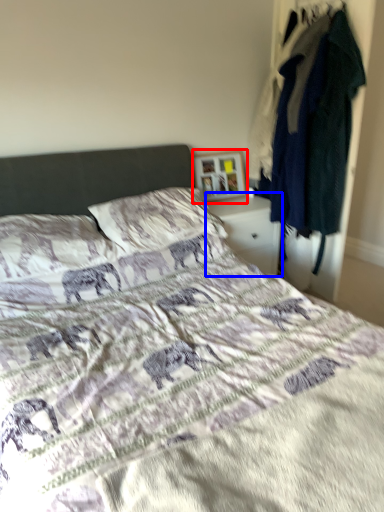
Question: Among these objects, which one is nearest to the camera, picture frame (highlighted by a red box) or nightstand (highlighted by a blue box)?

Choices:
 (A) picture frame
 (B) nightstand

Answer: (B)